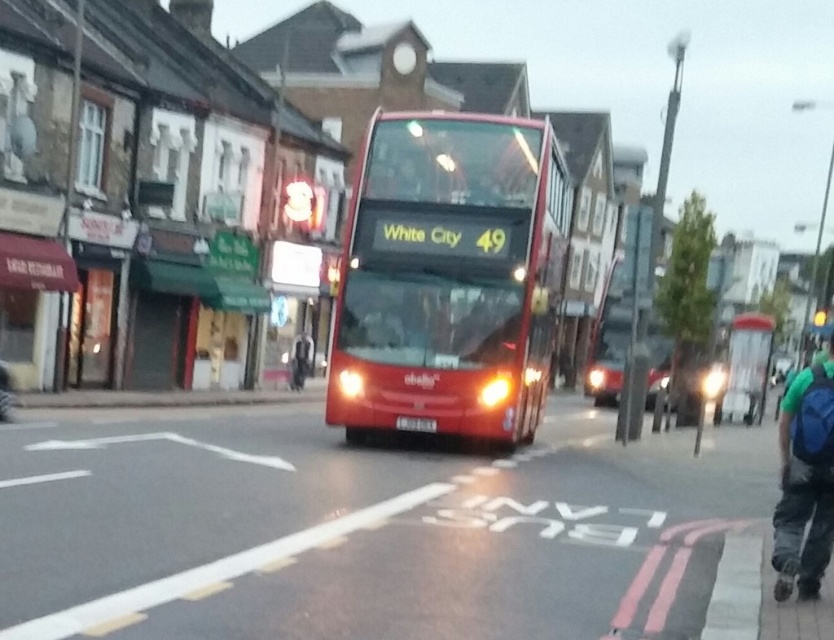
You are a pedestrian waiting to cross the street. You see the shiny red bus at center and the blue backpack at lower right. Which object is closer to you?

The shiny red bus at center is closer to you because the blue backpack at lower right is behind it.

You are a delivery drone planning to land on the road. The landing zone must be clear of the shiny red bus at center. According to the coordinates provided, where should you land to avoid it?

The shiny red bus at center is located at point (x=450, y=276). To avoid it, land outside this coordinate area.